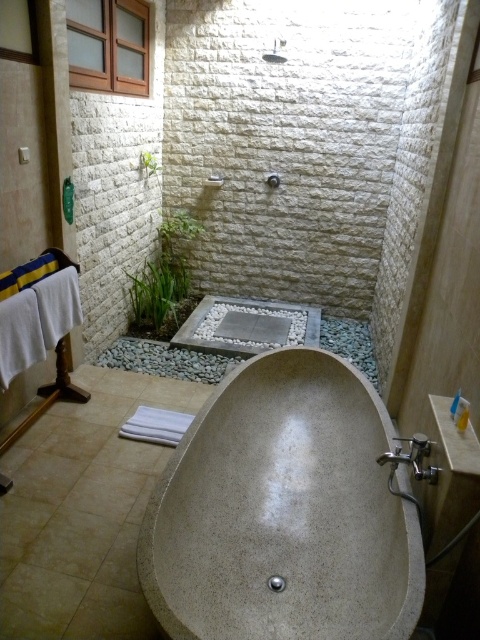
You are standing in the bathroom and want to move from the garden bed to the showerhead. The garden bed is located at point [431,442], and the showerhead is at point [278,522]. Based on their positions, which direction should you move to reach the showerhead from the garden bed?

To reach the showerhead at point [278,522] from the garden bed at point [431,442], you should move forward because point [278,522] is behind point [431,442].

You are standing in the bathroom and want to take a bath. Where is the matte stone bathtub at center located?

The matte stone bathtub at center is located at point (283, 513).